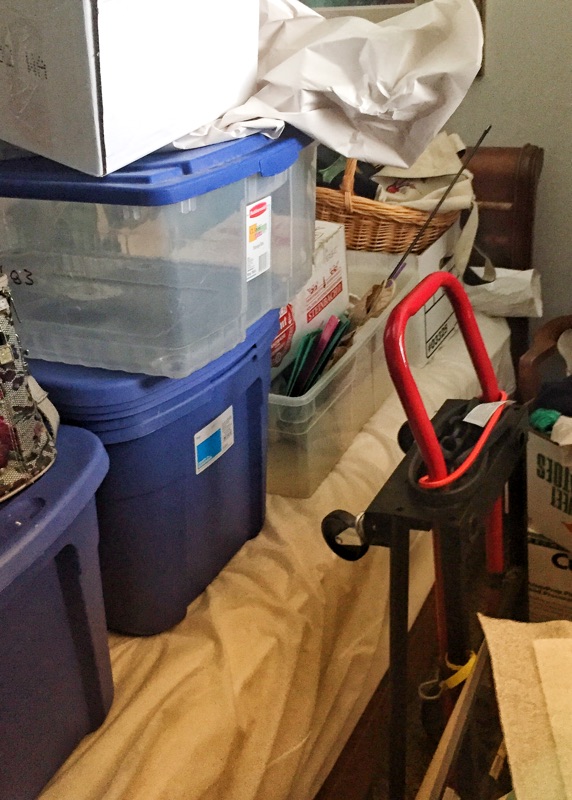
I want to click on small portable dolly, so click(x=419, y=518).